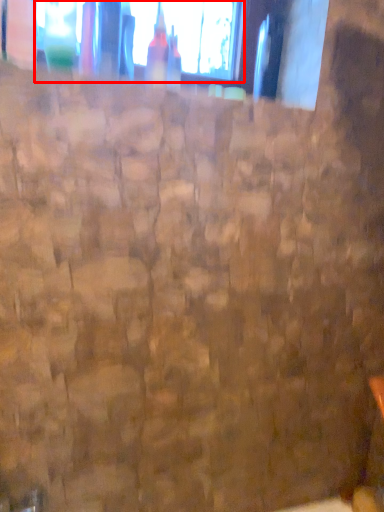
Question: From the image's perspective, considering the relative positions of window (annotated by the red box) and bottle in the image provided, where is window (annotated by the red box) located with respect to the staircase?

Choices:
 (A) below
 (B) above

Answer: (B)